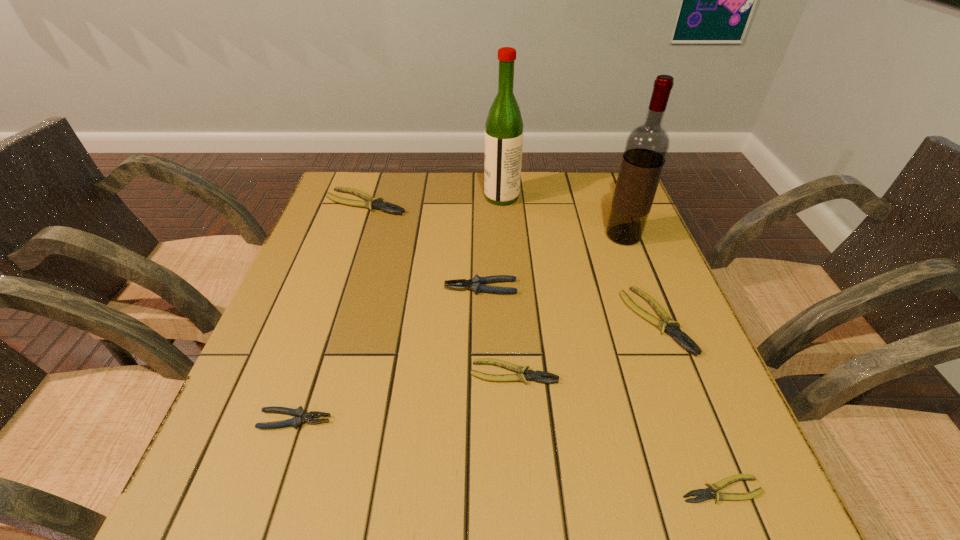
You are a GUI agent. You are given a task and a screenshot of the screen. Output one action in this format:
    pyautogui.click(x=<x>, y=<y>)
    Task: Click on the second shortest object
    Image resolution: width=960 pixels, height=540 pixels.
    Given the screenshot: What is the action you would take?
    pyautogui.click(x=531, y=375)

The image size is (960, 540). Identify the location of the smallest yellow pliers. (705, 494).

The width and height of the screenshot is (960, 540). Find the location of `the shortest object`. the shortest object is located at coordinates (705, 494).

Find the location of a particular element. This screenshot has height=540, width=960. free space located 0.230m on the label of the green liquor is located at coordinates tap(407, 197).

Find the location of a particular element. This screenshot has height=540, width=960. vacant space situated 0.120m on the label of the green liquor is located at coordinates (444, 197).

I want to click on free space located 0.380m on the label of the green liquor, so click(x=356, y=197).

Locate an element on the screen. The height and width of the screenshot is (540, 960). free space located on the front of the third farthest object is located at coordinates (660, 331).

The height and width of the screenshot is (540, 960). I want to click on vacant space situated 0.100m at the gripping part of the farther gray pliers, so click(x=401, y=287).

Identify the location of vacant space located at the gripping part of the farther gray pliers. The width and height of the screenshot is (960, 540). (324, 287).

I want to click on free space located 0.330m at the gripping part of the farther gray pliers, so click(302, 287).